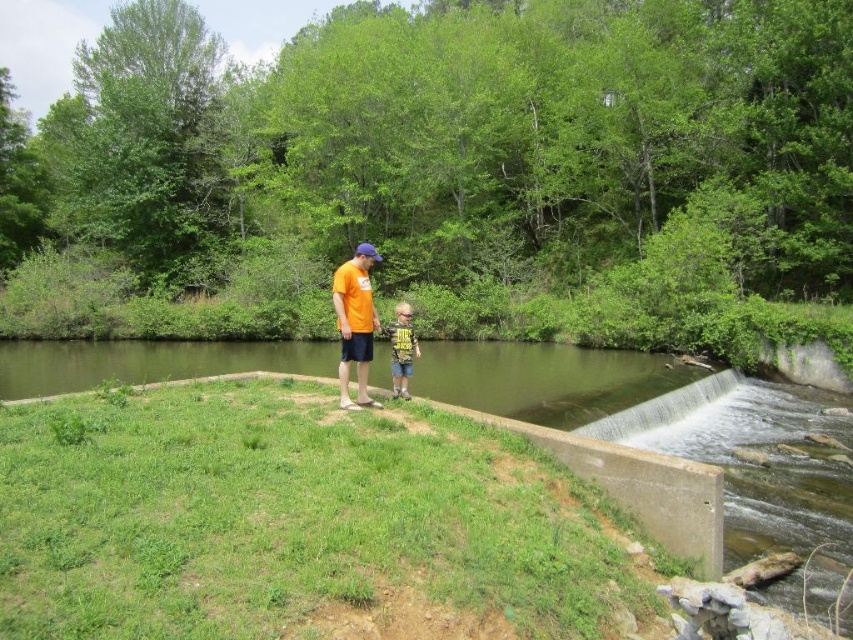
Is point (817, 408) positioned behind point (354, 310)?

That is True.

Is point (813, 374) positioned before point (345, 396)?

No.

I want to click on green concrete water at center, so click(x=686, y=433).

This screenshot has height=640, width=853. Describe the element at coordinates (355, 323) in the screenshot. I see `orange t-shirt at center` at that location.

How distant is orange t-shirt at center from matte green t-shirt at center?

2.39 meters

Does point (367, 284) come in front of point (387, 330)?

Yes, it is in front of point (387, 330).

Identify the location of orange t-shirt at center. This screenshot has height=640, width=853. (355, 323).

Can you confirm if green concrete water at center is taller than matte green t-shirt at center?

In fact, green concrete water at center may be shorter than matte green t-shirt at center.

Between point (796, 394) and point (397, 369), which one is positioned in front?

Positioned in front is point (397, 369).

The image size is (853, 640). I want to click on green concrete water at center, so click(x=686, y=433).